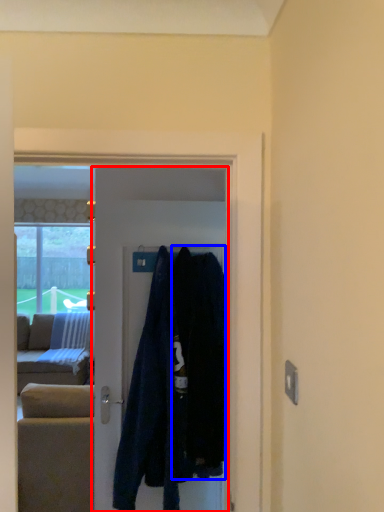
Question: Which of the following is the farthest to the observer, door (highlighted by a red box) or clothing (highlighted by a blue box)?

Choices:
 (A) door
 (B) clothing

Answer: (A)